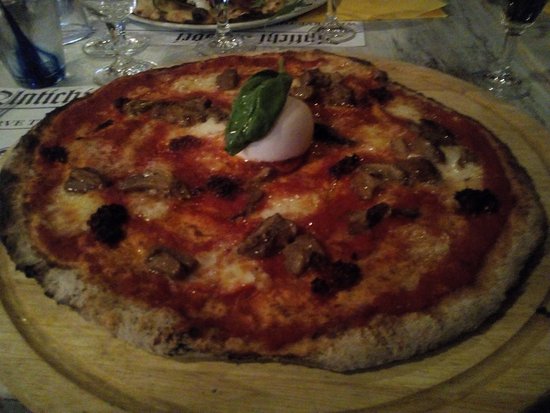
At what (x,y) coordinates should I click in order to perform the action: click on plate. Please return your answer as a coordinate pair (x, y). Image resolution: width=550 pixels, height=413 pixels. Looking at the image, I should click on (154, 27).